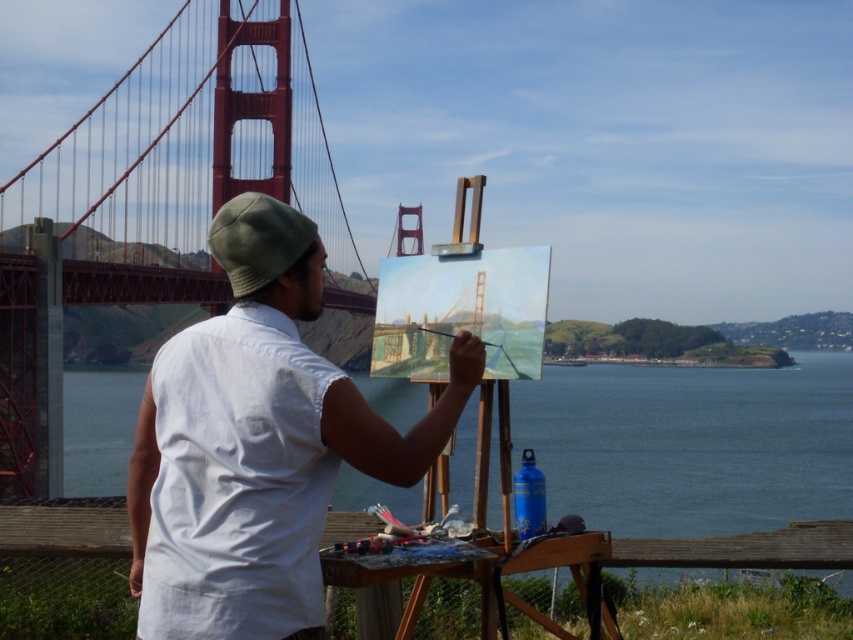
You are an art student observing the artist painting the Golden Gate Bridge. You notice the blue water at center and the wooden handle paintbrush at center. Which object in the scene is bigger?

The blue water at center is larger than the wooden handle paintbrush at center.

You are a photographer standing in the same spot as the artist. You want to take a photo that includes both the white cotton shirt at center and the blue water at center. Which object will appear smaller in the photo?

The white cotton shirt at center will appear smaller in the photo because it is not as tall as the blue water at center.

Based on the scene description, where is the blue water at center located in the image?

The blue water at center is located at point (691,444).